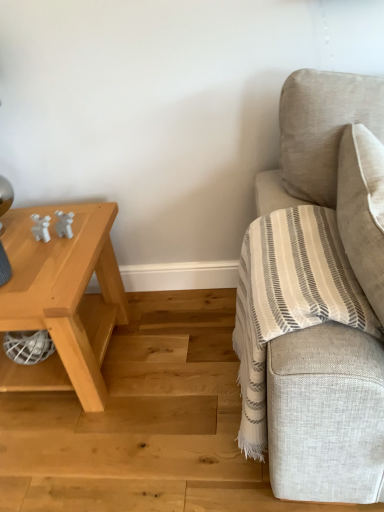
The height and width of the screenshot is (512, 384). In order to click on free space above light wood table at left (from a real-world perspective) in this screenshot , I will do `click(35, 248)`.